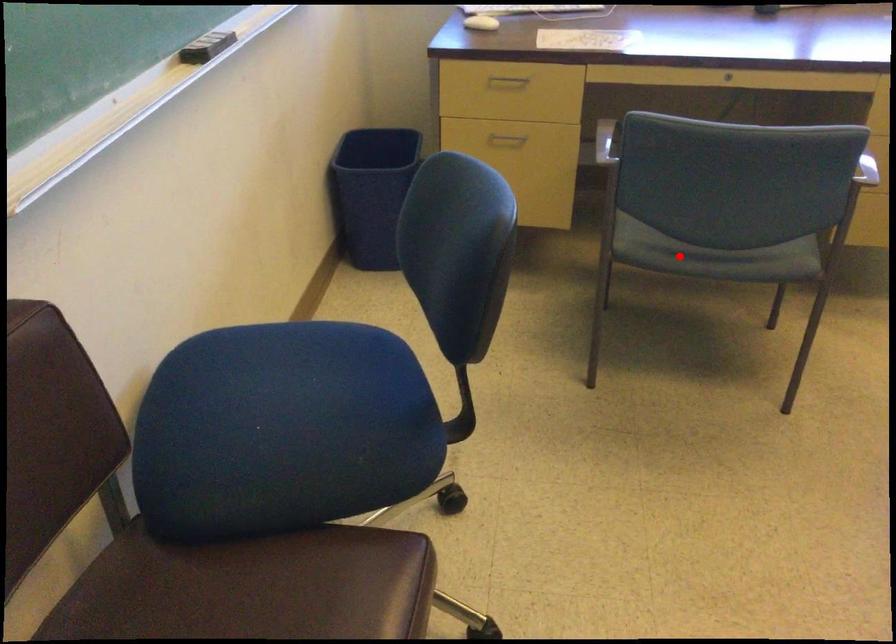
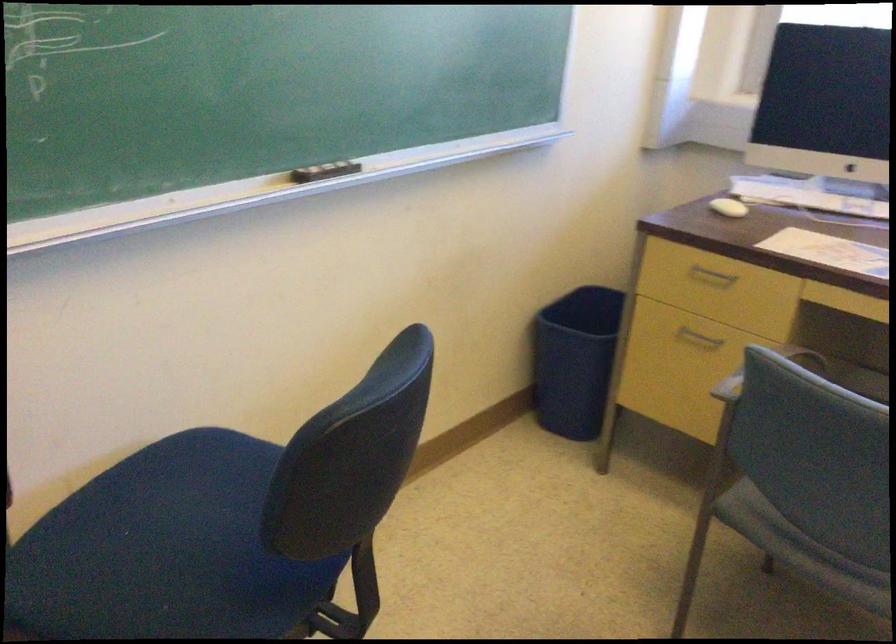
Question: I am providing you with two images of the same scene from different viewpoints. In image1, a red point is highlighted. Considering the same 3D point in image2, which of the following is correct?

Choices:
 (A) It is closer
 (B) It is farther

Answer: (A)